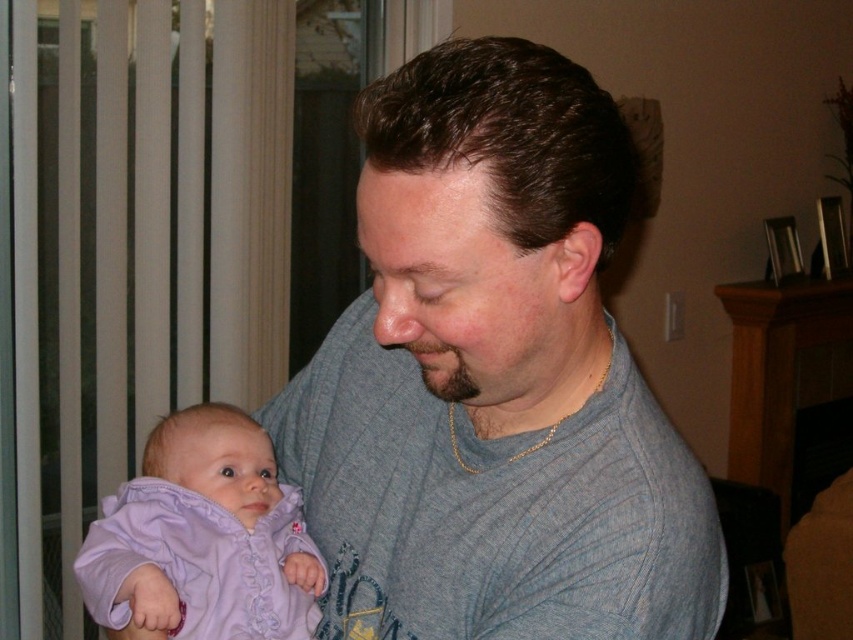
Question: Can you confirm if gray knit sweater at center is bigger than lavender soft fabric baby at left?

Choices:
 (A) yes
 (B) no

Answer: (A)

Question: Is gray knit sweater at center positioned before lavender soft fabric baby at left?

Choices:
 (A) no
 (B) yes

Answer: (B)

Question: Among these points, which one is nearest to the camera?

Choices:
 (A) (457, 104)
 (B) (107, 579)

Answer: (A)

Question: Among these points, which one is farthest from the camera?

Choices:
 (A) [434, 58]
 (B) [306, 609]

Answer: (B)

Question: Does gray knit sweater at center appear over lavender soft fabric baby at left?

Choices:
 (A) yes
 (B) no

Answer: (A)